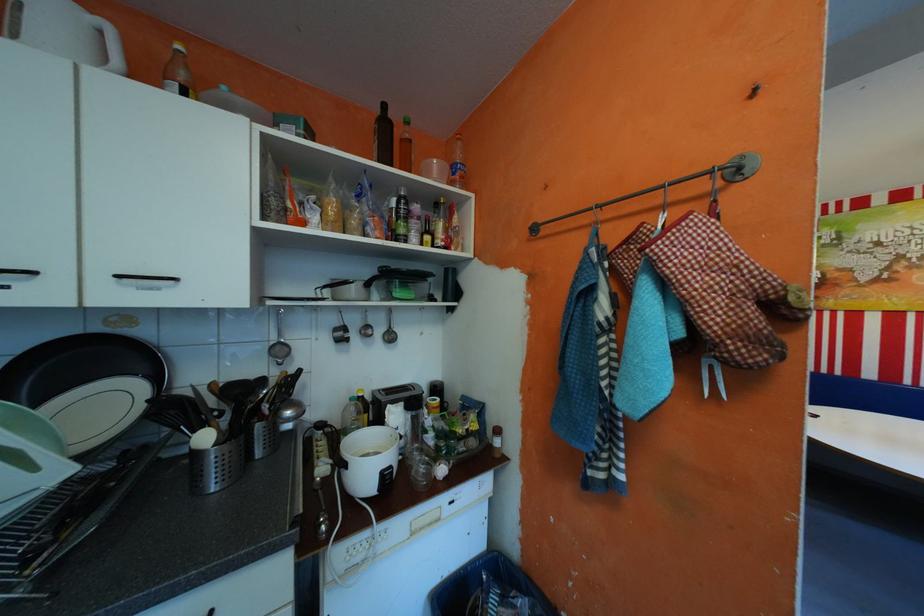
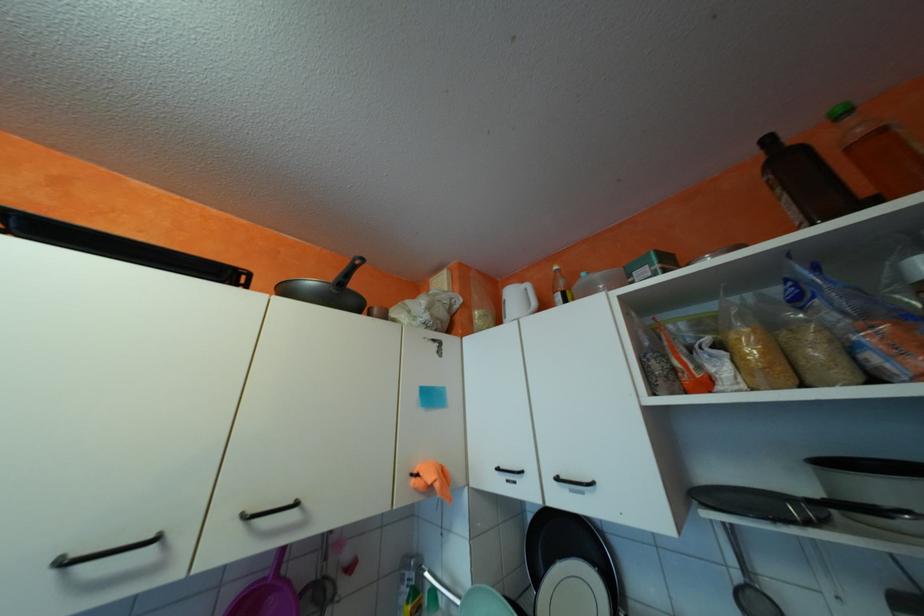
The images are taken continuously from a first-person perspective. In which direction is your viewpoint rotating?

The rotation direction of the camera is left-up.